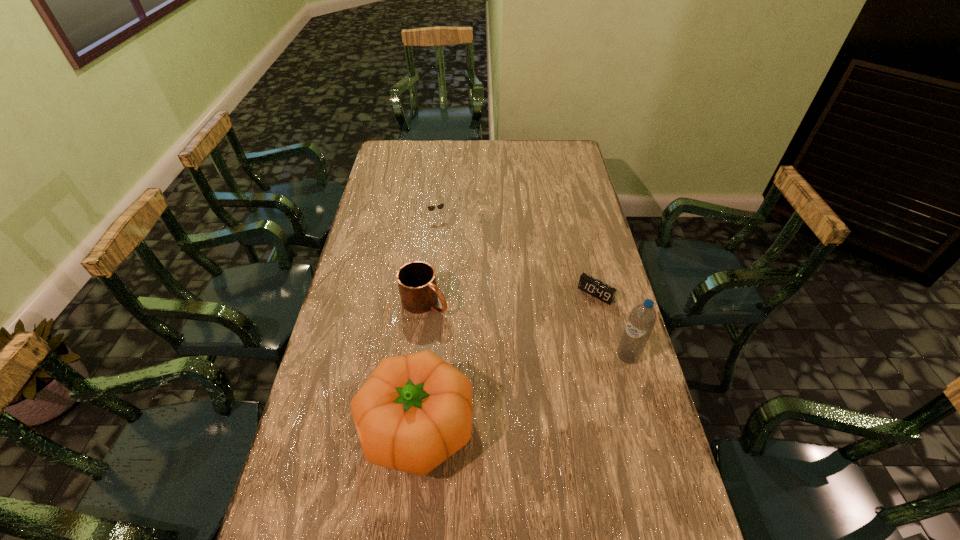
Where is `water bottle located at the right edge`? The width and height of the screenshot is (960, 540). water bottle located at the right edge is located at coordinates (642, 319).

The image size is (960, 540). Find the location of `alarm clock located in the right edge section of the desktop`. alarm clock located in the right edge section of the desktop is located at coordinates 596,288.

Identify the location of vacant space at the far edge. The width and height of the screenshot is (960, 540). (445, 164).

In the image, there is a desktop. Where is `vacant space at the left edge`? This screenshot has height=540, width=960. vacant space at the left edge is located at coordinates (395, 169).

At what (x,y) coordinates should I click in order to perform the action: click on vacant region at the right edge of the desktop. Please return your answer as a coordinate pair (x, y). This screenshot has height=540, width=960. Looking at the image, I should click on (619, 396).

In the image, there is a desktop. Identify the location of free region at the near left corner. (350, 498).

The image size is (960, 540). In order to click on free space at the far right corner in this screenshot , I will do `click(558, 163)`.

Locate an element on the screen. free point between the shortest object and the sunglasses is located at coordinates (516, 255).

I want to click on vacant area between the nearest object and the fourth tallest object, so click(426, 321).

Find the location of a particular element. This screenshot has width=960, height=540. vacant area that lies between the shortest object and the third tallest object is located at coordinates (511, 298).